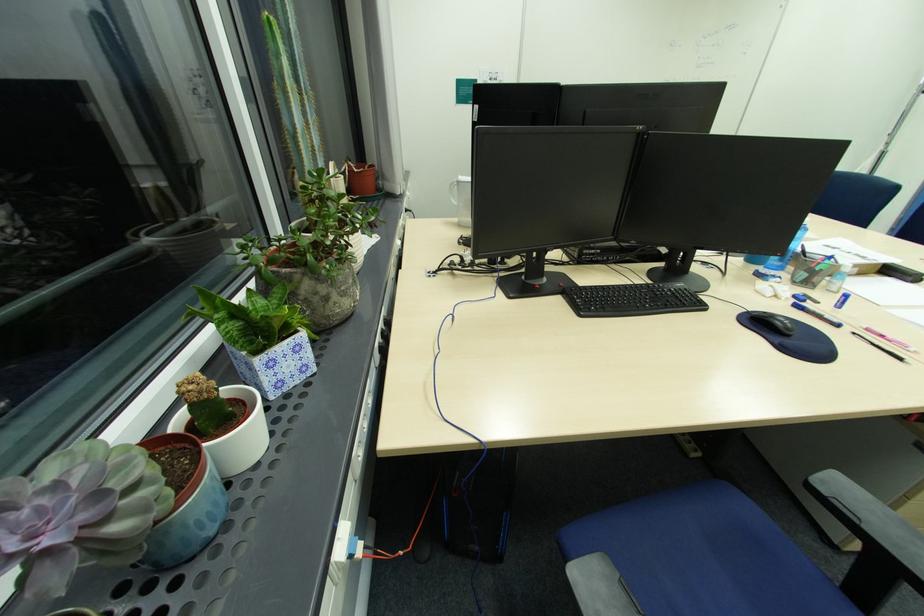
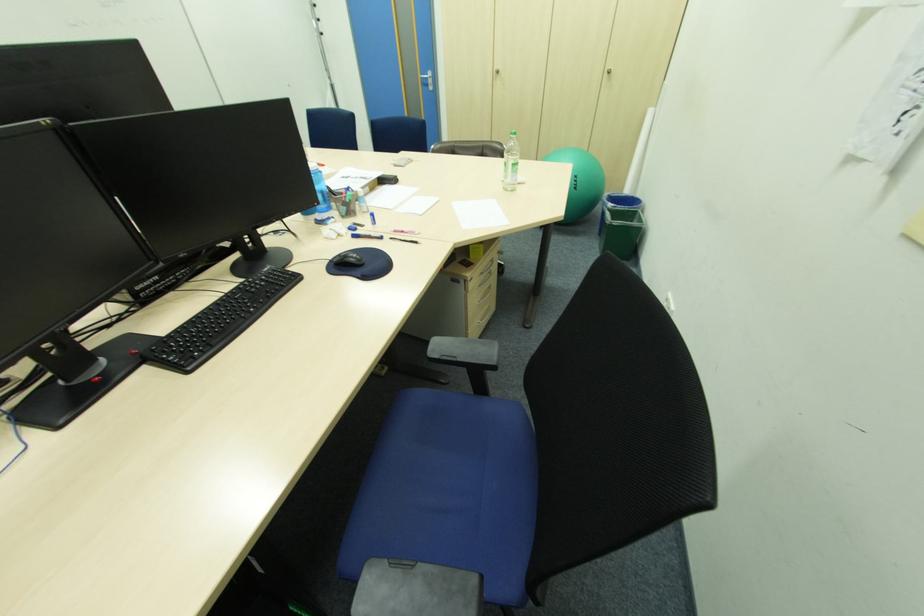
Find the pixel in the second image that matches (x=834, y=292) in the first image.

(370, 213)